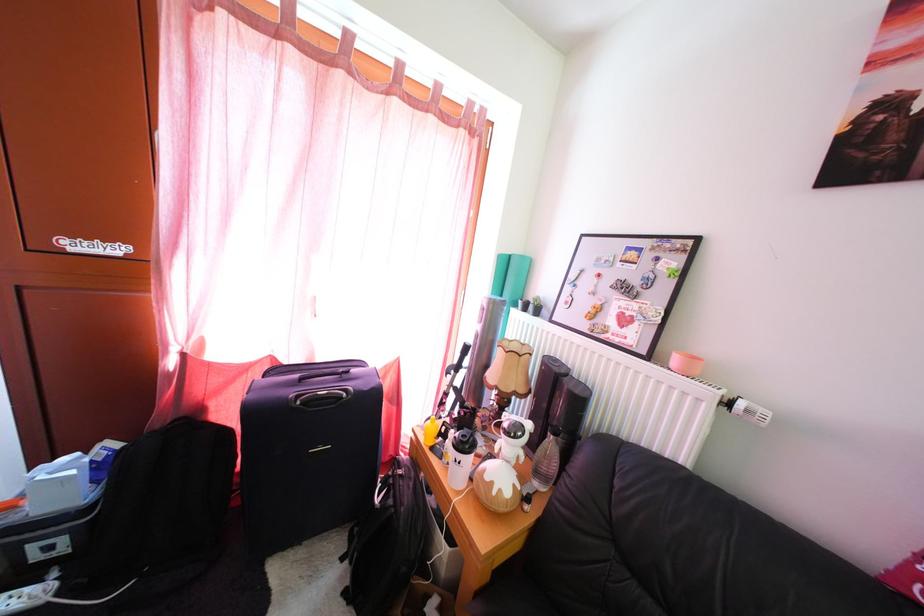
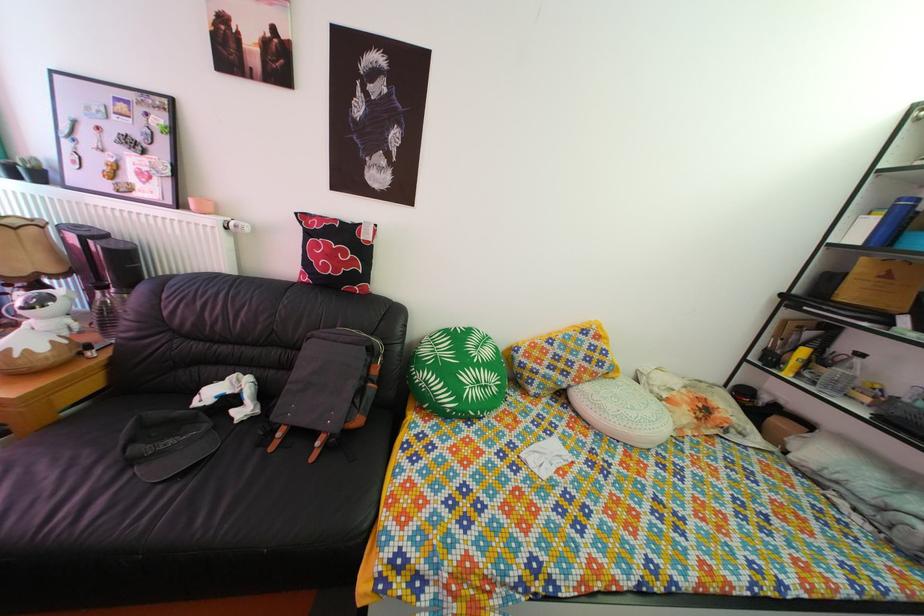
The point at (772, 419) is marked in the first image. Where is the corresponding point in the second image?

(249, 232)